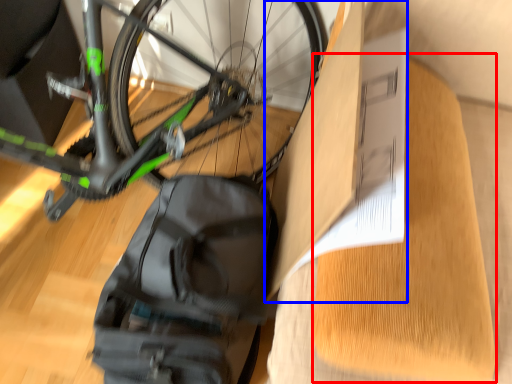
Question: Which object appears farthest to the camera in this image, cardboard (highlighted by a red box) or cardboard box (highlighted by a blue box)?

Choices:
 (A) cardboard
 (B) cardboard box

Answer: (B)